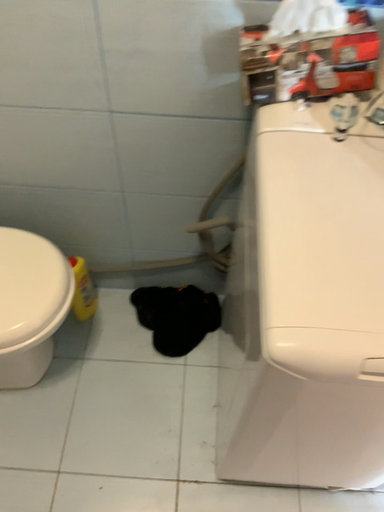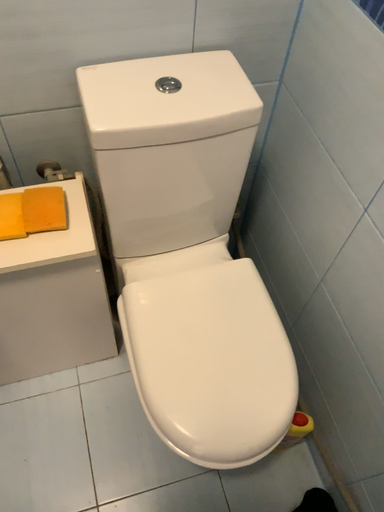
Question: How did the camera likely rotate when shooting the video?

Choices:
 (A) rotated downward
 (B) rotated upward

Answer: (B)